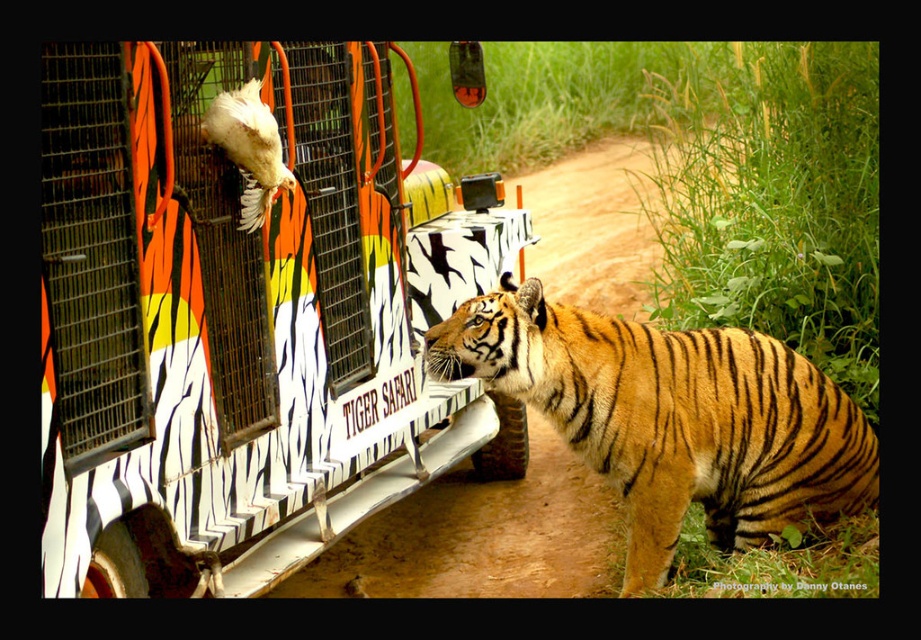
Can you confirm if orange-yellow fur tiger at center is smaller than white fluffy chicken at upper left?

Incorrect, orange-yellow fur tiger at center is not smaller in size than white fluffy chicken at upper left.

Does orange-yellow fur tiger at center lie in front of white fluffy chicken at upper left?

No, orange-yellow fur tiger at center is behind white fluffy chicken at upper left.

This screenshot has height=640, width=921. I want to click on orange-yellow fur tiger at center, so click(x=671, y=419).

Find the location of `orange-yellow fur tiger at center`. orange-yellow fur tiger at center is located at coordinates (671, 419).

Who is lower down, zebra-striped truck at center or orange-yellow fur tiger at center?

Positioned lower is orange-yellow fur tiger at center.

Can you confirm if zebra-striped truck at center is smaller than orange-yellow fur tiger at center?

No, zebra-striped truck at center is not smaller than orange-yellow fur tiger at center.

The height and width of the screenshot is (640, 921). In order to click on zebra-striped truck at center in this screenshot , I will do `click(241, 320)`.

The width and height of the screenshot is (921, 640). I want to click on zebra-striped truck at center, so click(x=241, y=320).

How much distance is there between zebra-striped truck at center and white fluffy chicken at upper left?

zebra-striped truck at center is 17.94 inches from white fluffy chicken at upper left.

Which is behind, point (460, 417) or point (252, 83)?

Point (460, 417)

I want to click on zebra-striped truck at center, so click(x=241, y=320).